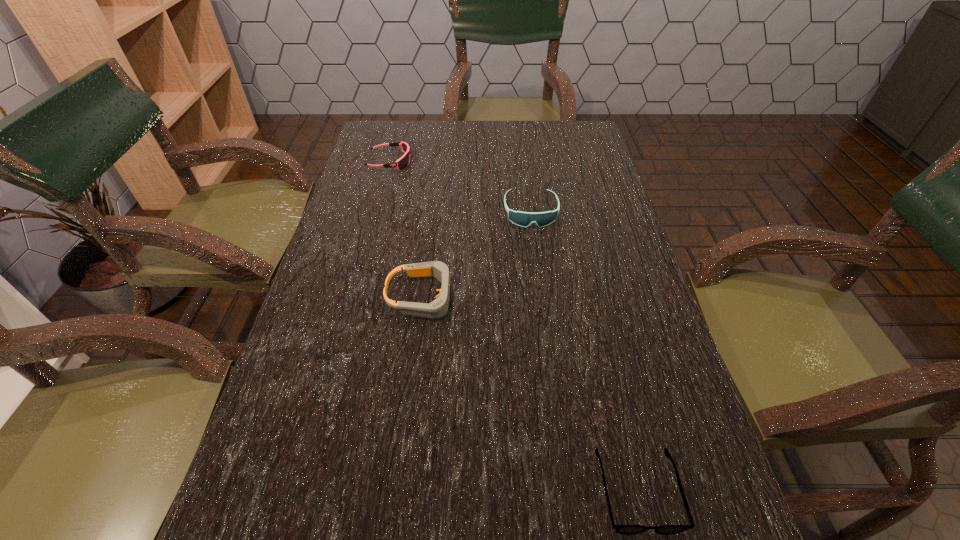
Where is `the third nearest object`? Image resolution: width=960 pixels, height=540 pixels. the third nearest object is located at coordinates (524, 219).

This screenshot has height=540, width=960. I want to click on the rightmost goggles, so click(524, 219).

Where is `the second goggles from left to right`? The image size is (960, 540). the second goggles from left to right is located at coordinates (438, 308).

Locate an element on the screen. This screenshot has width=960, height=540. the nearest goggles is located at coordinates (x=438, y=308).

Where is `the farthest goggles`? This screenshot has height=540, width=960. the farthest goggles is located at coordinates (401, 163).

I want to click on the leftmost object, so click(x=401, y=163).

This screenshot has height=540, width=960. In order to click on the nearest object in this screenshot , I will do `click(621, 529)`.

Find the location of `free point located 0.330m on the front-facing side of the second nearest goggles`. free point located 0.330m on the front-facing side of the second nearest goggles is located at coordinates (546, 332).

Locate an element on the screen. Image resolution: width=960 pixels, height=540 pixels. vacant space situated 0.160m on the front and back of the second nearest object is located at coordinates (532, 297).

Where is `vacant space located 0.070m on the front-facing side of the leftmost goggles`? vacant space located 0.070m on the front-facing side of the leftmost goggles is located at coordinates [434, 162].